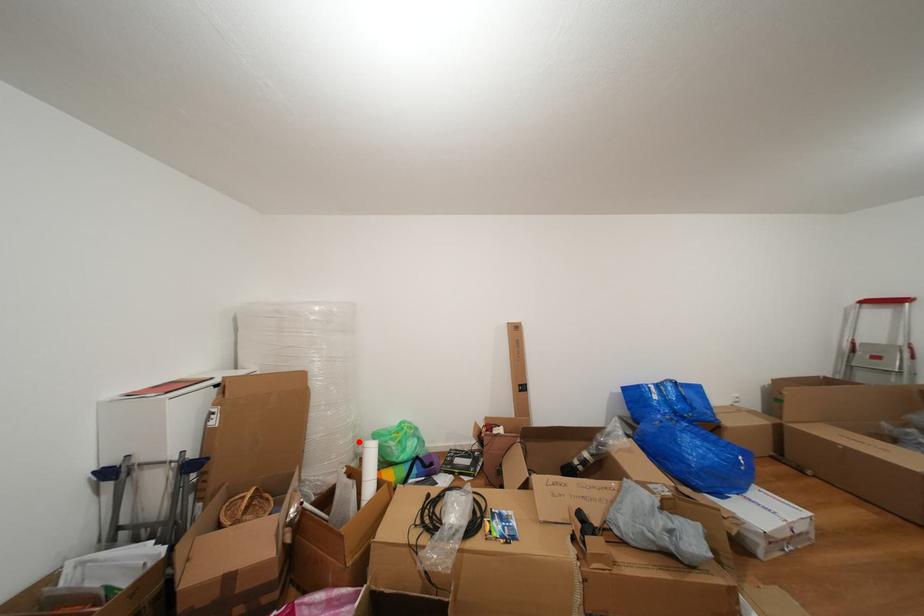
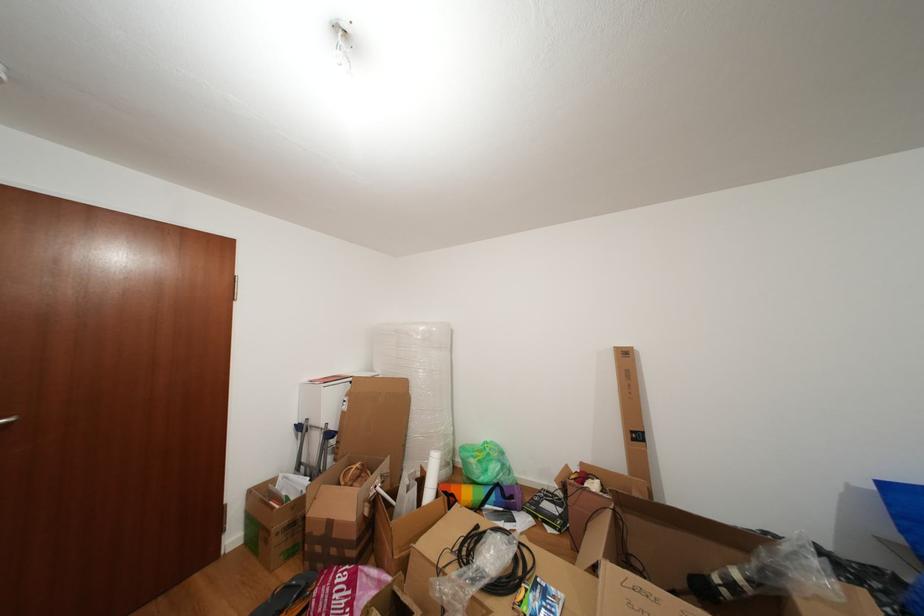
The point at the highlighted location is marked in the first image. Where is the corresponding point in the second image?

(450, 448)